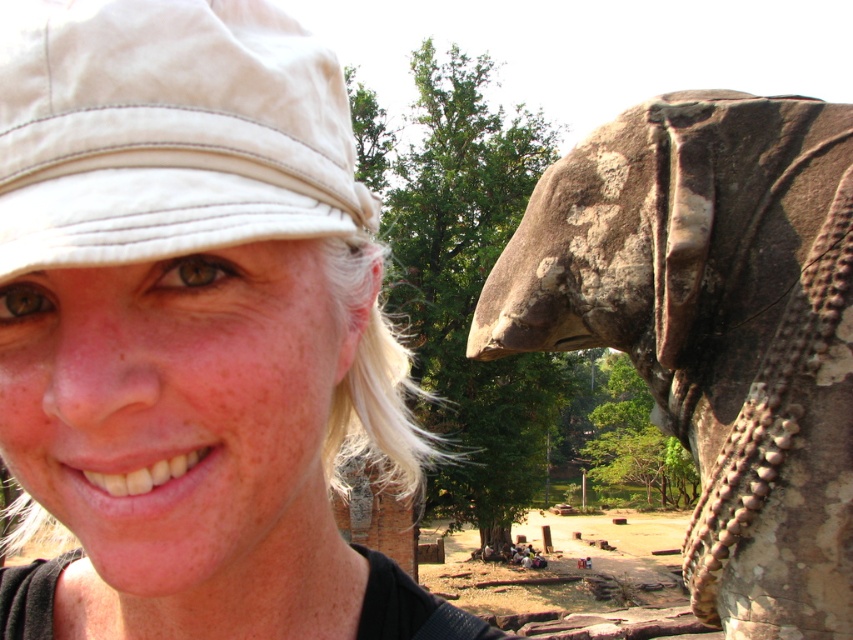
In the scene shown: You are standing in a park and see the white matte hat at upper left and the rusty stone elephant at right. Which object is positioned more to the left side of the scene?

The white matte hat at upper left is positioned more to the left side of the scene than the rusty stone elephant at right.

You are a photographer trying to capture a shot of the white matte hat at upper left and the rusty stone elephant at right. If you want to ensure both objects are in the frame, which object should you position closer to the camera to maintain their sizes in the photo?

The white matte hat at upper left has a lesser width compared to the rusty stone elephant at right. To maintain their sizes in the photo, you should position the white matte hat at upper left closer to the camera since it is smaller in width and needs to appear larger in the frame to match the size of the rusty stone elephant at right.

You are standing in a park and see a person on the left and a large stone sculpture of an elephant on the right. There is a specific point marked at coordinates (714, 326). Based on the scene description, can you determine where this point is located?

The point at coordinates (714, 326) is located on the rusty stone elephant at right.